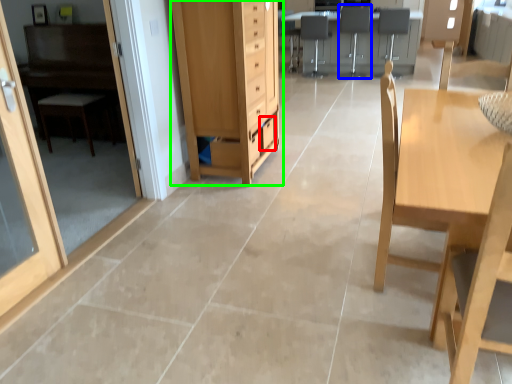
Question: Considering the real-world distances, which object is farthest from drawer (highlighted by a red box)? armchair (highlighted by a blue box) or cabinetry (highlighted by a green box)?

Choices:
 (A) armchair
 (B) cabinetry

Answer: (A)